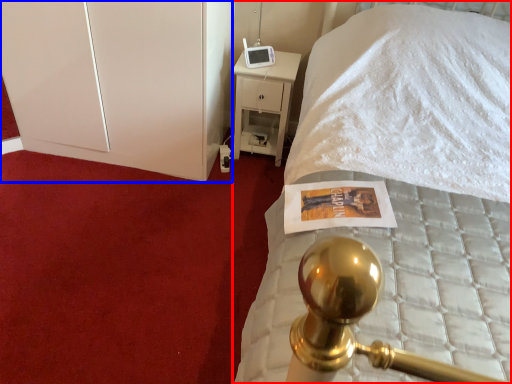
Question: Which object appears farthest to the camera in this image, bed (highlighted by a red box) or dresser (highlighted by a blue box)?

Choices:
 (A) bed
 (B) dresser

Answer: (B)